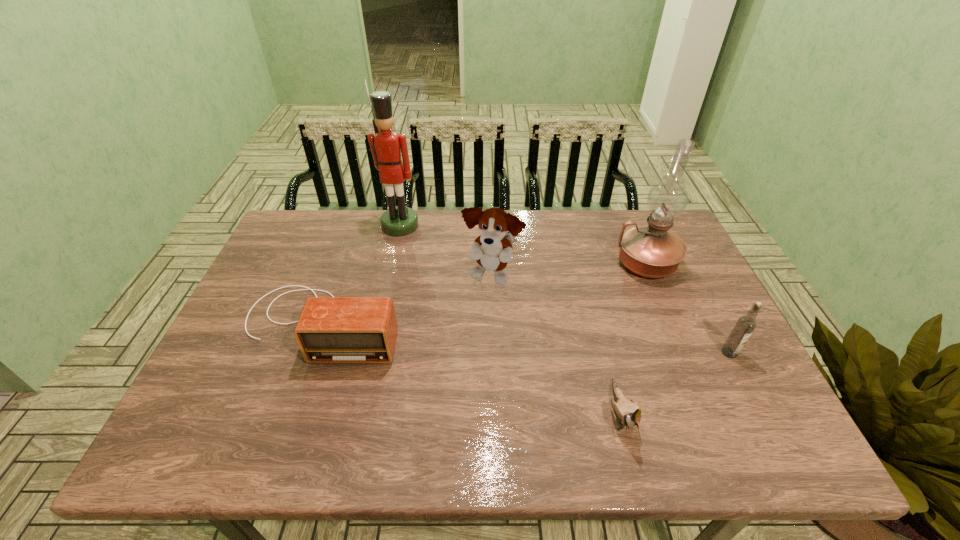
I want to click on object that is positioned at the far right corner, so click(652, 251).

The height and width of the screenshot is (540, 960). In order to click on free region at the far edge of the desktop in this screenshot , I will do `click(623, 224)`.

You are a GUI agent. You are given a task and a screenshot of the screen. Output one action in this format:
    pyautogui.click(x=<x>, y=<y>)
    Task: Click on the vacant area at the near edge of the desktop
    
    Given the screenshot: What is the action you would take?
    pyautogui.click(x=274, y=456)

Locate an element on the screen. The height and width of the screenshot is (540, 960). free space at the left edge is located at coordinates coord(310,265).

Image resolution: width=960 pixels, height=540 pixels. I want to click on free space at the right edge of the desktop, so click(687, 368).

I want to click on free space at the near left corner of the desktop, so click(x=238, y=449).

At what (x,y) coordinates should I click in order to perform the action: click on blank space at the far right corner. Please return your answer as a coordinate pair (x, y). The width and height of the screenshot is (960, 540). Looking at the image, I should click on (638, 212).

Find the location of `vacant space at the near right corner of the desktop`. vacant space at the near right corner of the desktop is located at coordinates (757, 440).

Find the location of a particular element. This screenshot has height=540, width=960. vacant area between the nearest object and the vodka is located at coordinates (675, 383).

This screenshot has height=540, width=960. I want to click on empty space that is in between the fourth object from left to right and the second tallest object, so click(x=633, y=338).